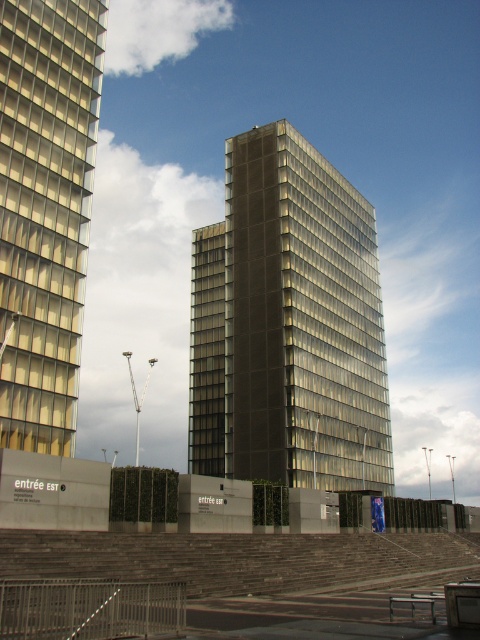
Question: Is matte glass tower at center above matte glass building at left?

Choices:
 (A) yes
 (B) no

Answer: (B)

Question: Which point is farther to the camera?

Choices:
 (A) matte glass tower at center
 (B) matte glass building at left

Answer: (A)

Question: Can you confirm if matte glass tower at center is wider than matte glass building at left?

Choices:
 (A) no
 (B) yes

Answer: (B)

Question: Where is matte glass tower at center located in relation to matte glass building at left in the image?

Choices:
 (A) above
 (B) below

Answer: (B)

Question: Which point is farther to the camera?

Choices:
 (A) matte glass tower at center
 (B) matte glass building at left

Answer: (A)